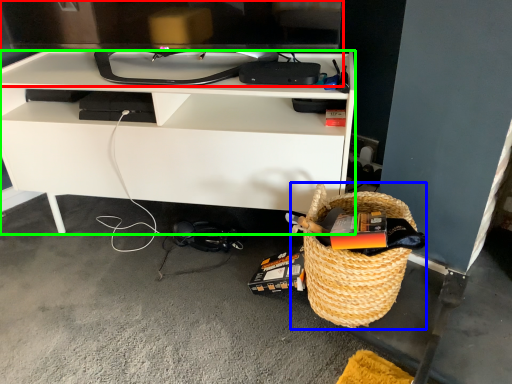
Question: Which object is the closest to the television (highlighted by a red box)? Choose among these: picnic basket (highlighted by a blue box) or desk (highlighted by a green box).

Choices:
 (A) picnic basket
 (B) desk

Answer: (B)